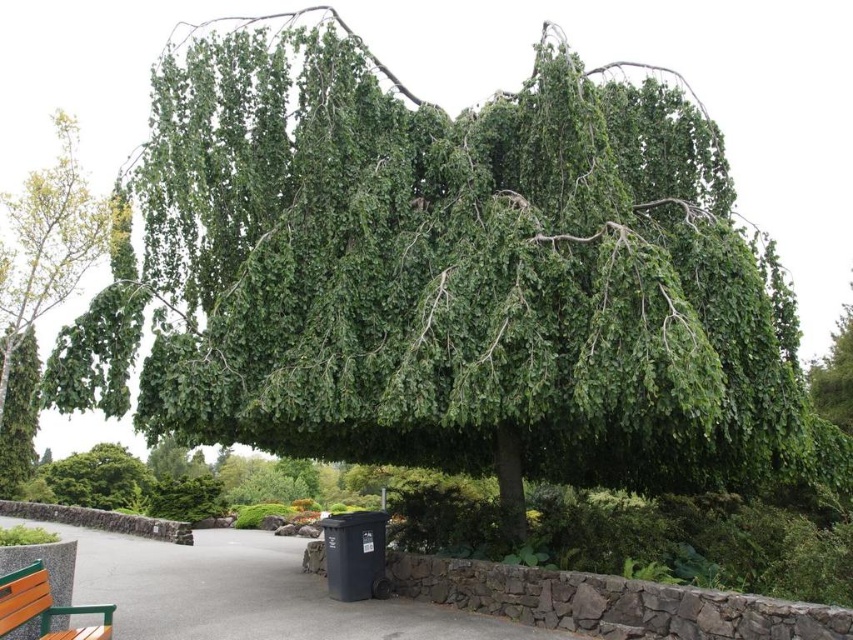
You are planning to place a new garden ornament that requires a space smaller than the green leafy tree at left. Can the wooden bench at lower left accommodate it?

The wooden bench at lower left is smaller than the green leafy tree at left, so it may not have enough space to accommodate the garden ornament that requires a space smaller than the tree.

You are standing in the garden and want to take a photo of the green leafy tree at left. If your camera can focus on objects up to 25 feet away, will it be able to capture the tree clearly?

The green leafy tree at left is 25.21 feet away from the viewer. Since the camera can focus up to 25 feet, it is slightly beyond the camera range, so the tree might not be captured clearly.